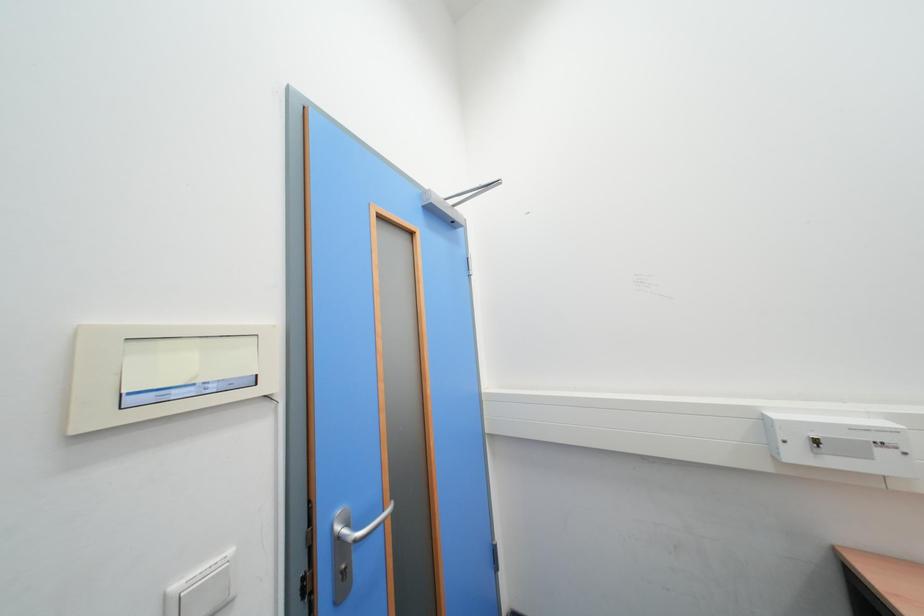
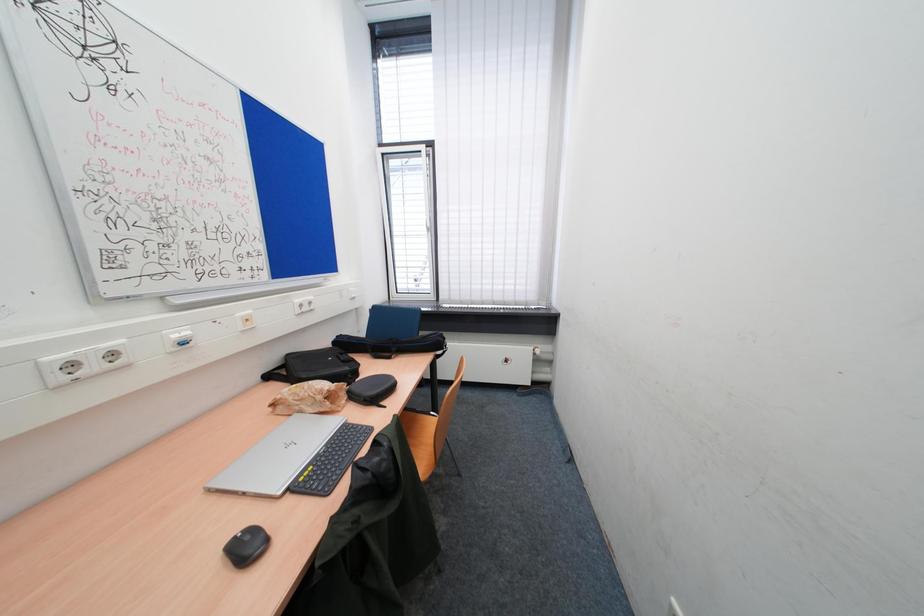
Question: The camera is either moving clockwise (left) or counter-clockwise (right) around the object. The first image is from the beginning of the video and the second image is from the end. Is the camera moving left or right when shooting the video?

Choices:
 (A) Left
 (B) Right

Answer: (A)